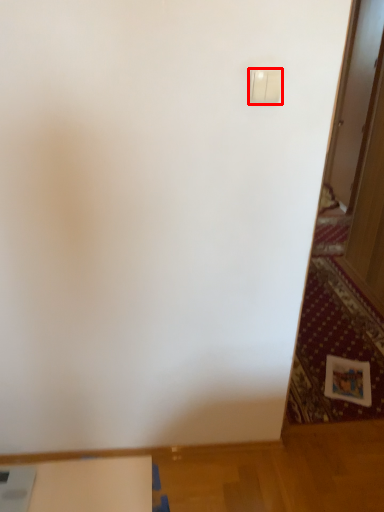
Question: In this image, where is light switch (annotated by the red box) located relative to table?

Choices:
 (A) left
 (B) right

Answer: (B)